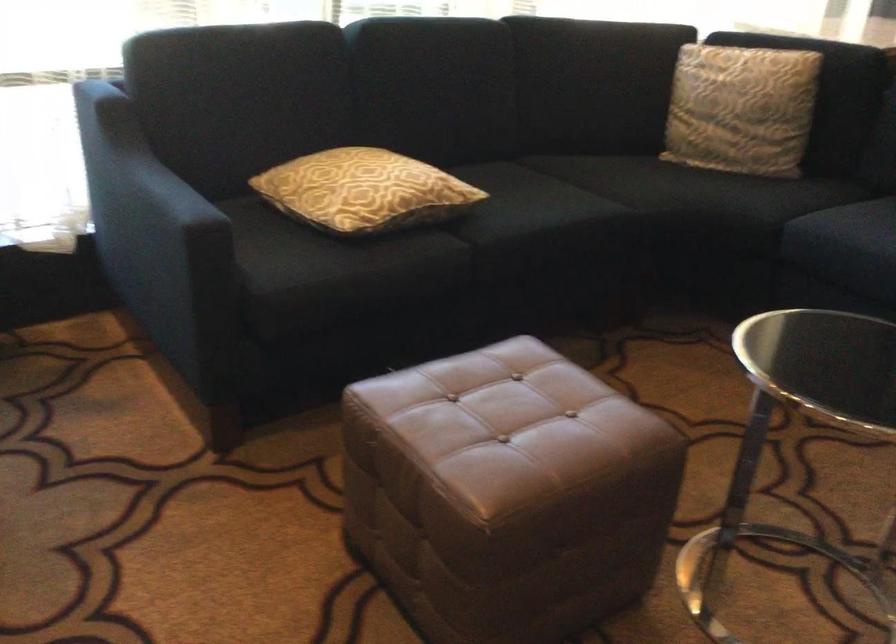
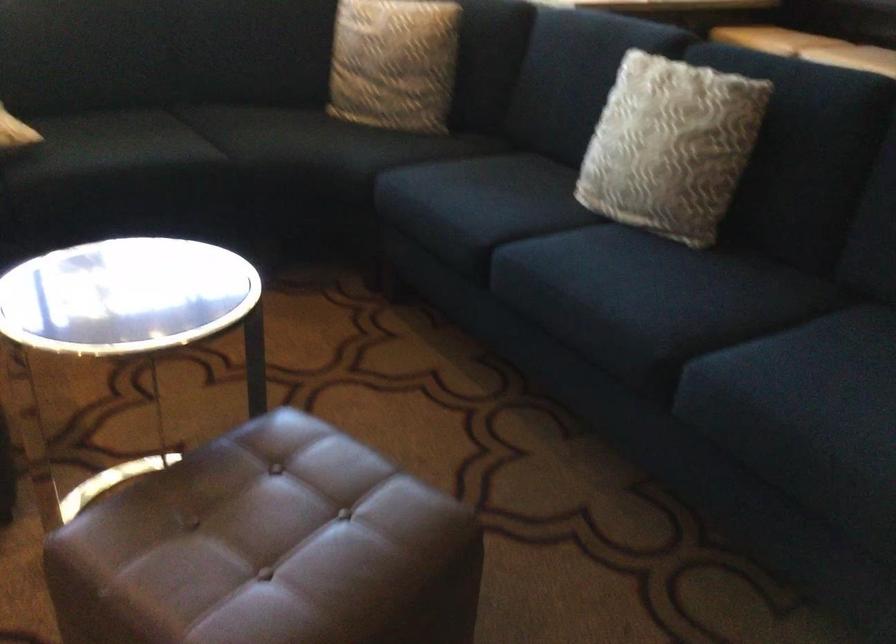
Question: What movement of the cameraman would produce the second image?

Choices:
 (A) Left
 (B) Right
 (C) Forward
 (D) Backward

Answer: (B)